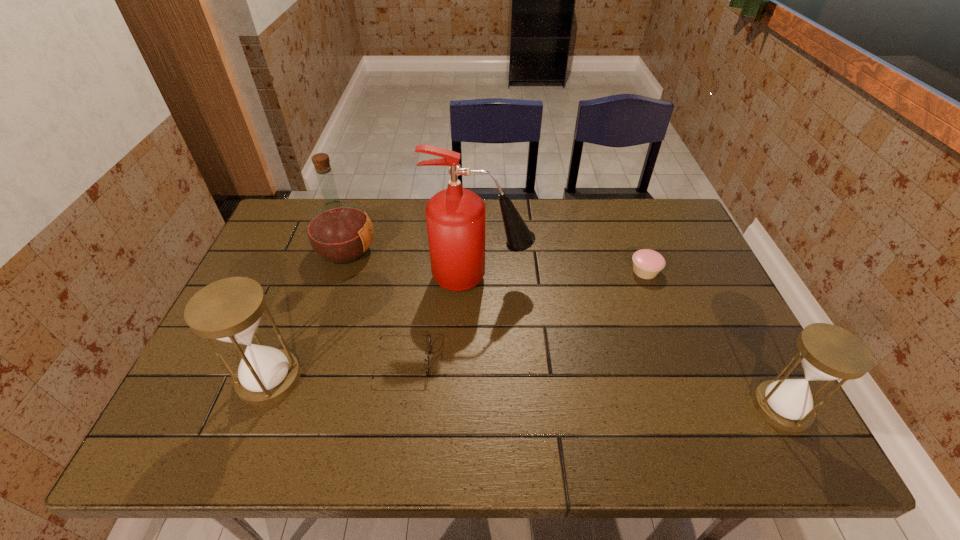
You are a GUI agent. You are given a task and a screenshot of the screen. Output one action in this format:
    pyautogui.click(x=<x>, y=<y>)
    Task: Click on the cupcake that is at the right edge
    The width and height of the screenshot is (960, 540).
    Given the screenshot: What is the action you would take?
    pyautogui.click(x=647, y=263)

Identify the location of object present at the far left corner. Image resolution: width=960 pixels, height=540 pixels. (339, 232).

The image size is (960, 540). I want to click on object that is at the near left corner, so click(x=229, y=310).

This screenshot has width=960, height=540. In order to click on object present at the near right corner in this screenshot , I will do `click(828, 352)`.

Find the location of a particular element. vacant space at the far edge of the desktop is located at coordinates (629, 216).

What are the coordinates of `vacant space at the near edge of the desktop` in the screenshot? It's located at (285, 409).

Where is `vacant point at the left edge`? Image resolution: width=960 pixels, height=540 pixels. vacant point at the left edge is located at coordinates (292, 267).

Locate an element on the screen. blank space at the right edge of the desktop is located at coordinates (713, 306).

In the image, there is a desktop. Identify the location of vacant space at the far left corner. The image size is (960, 540). (276, 239).

Find the location of a particular element. Image resolution: width=960 pixels, height=540 pixels. vacant area at the near right corner is located at coordinates (696, 380).